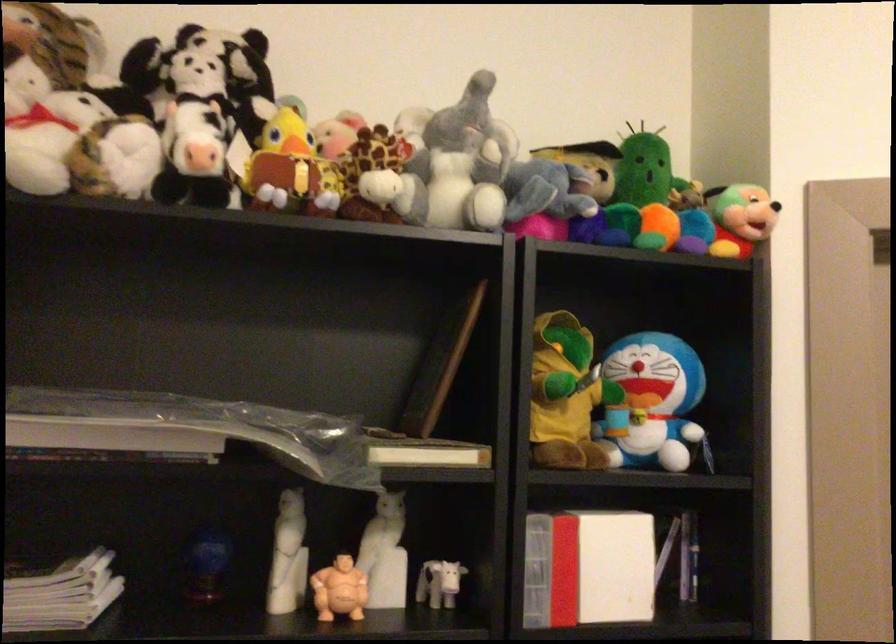
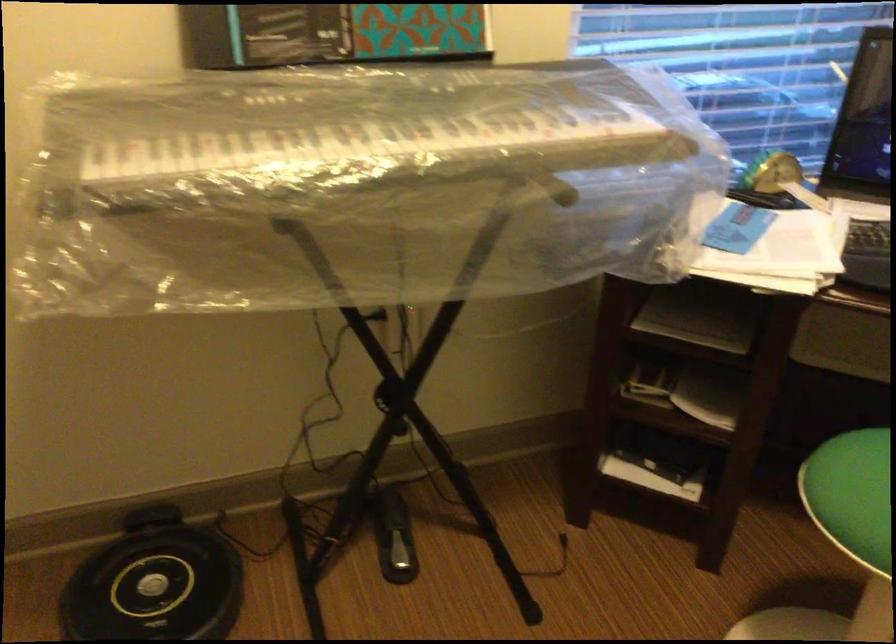
Consider the image. First-person continuous shooting, in which direction is the camera rotating?

The rotation direction of the camera is right-down.